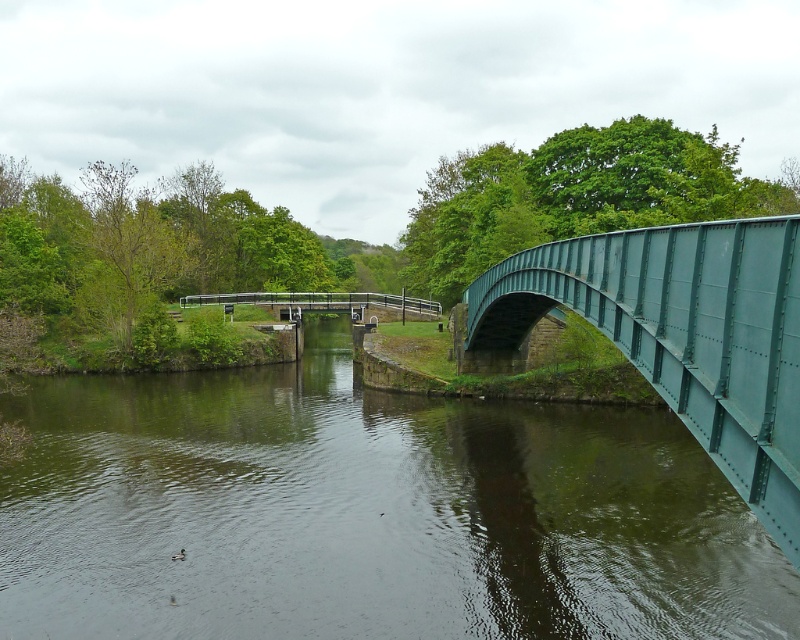
You are standing on the green metallic pedestrian bridge at center and want to observe the green metallic river at center. In which direction should you look to see the river?

The green metallic river at center is positioned under the green metallic pedestrian bridge at center, so you should look downward to see it.

You are standing at the point with coordinates point (462, 556) and want to walk towards the point with coordinates point (182, 305). Given the canal scene described, will you have to cross the green metal bridge on your way?

Yes, you will have to cross the green metal bridge on your way because point (462, 556) is in front of point (182, 305), meaning the bridge is between them.

You are standing on the green metallic bridge at right and want to see the green metallic river at center. Which direction should you look to see it?

You should look to the center to see the green metallic river at center because it is closer to you than the green metallic bridge at right.